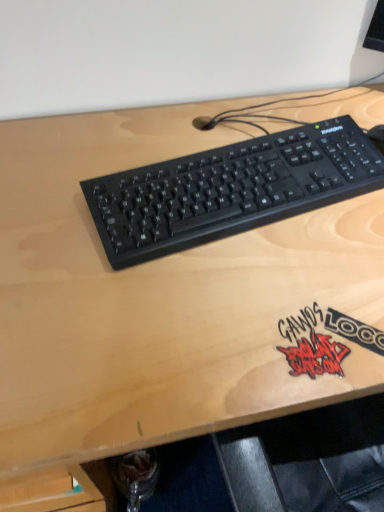
At what (x,y) coordinates should I click in order to perform the action: click on black matte keyboard at center. Please return your answer as a coordinate pair (x, y). The image size is (384, 512). Looking at the image, I should click on (230, 189).

Describe the element at coordinates (230, 189) in the screenshot. I see `black matte keyboard at center` at that location.

Identify the location of black matte keyboard at center. (230, 189).